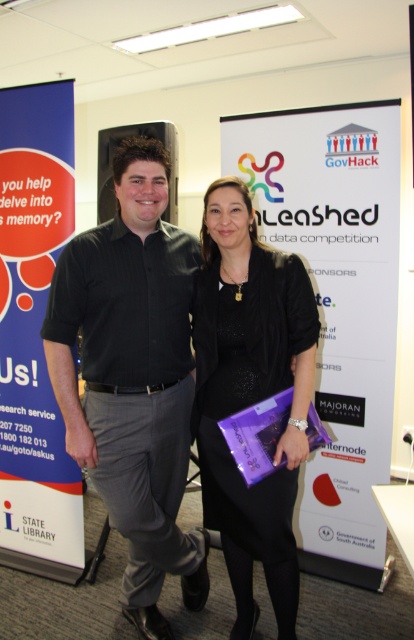
Question: Observing the image, what is the correct spatial positioning of black glossy shirt at left in reference to black satin dress at center?

Choices:
 (A) above
 (B) below

Answer: (A)

Question: Which of the following is the closest to the observer?

Choices:
 (A) (293, 342)
 (B) (159, 561)

Answer: (A)

Question: Does black glossy shirt at left appear on the left side of black satin dress at center?

Choices:
 (A) no
 (B) yes

Answer: (B)

Question: Does black glossy shirt at left appear on the right side of black satin dress at center?

Choices:
 (A) no
 (B) yes

Answer: (A)

Question: Which object is farther from the camera taking this photo?

Choices:
 (A) black satin dress at center
 (B) black glossy shirt at left

Answer: (B)

Question: Which point appears closest to the camera in this image?

Choices:
 (A) (286, 524)
 (B) (122, 579)

Answer: (A)